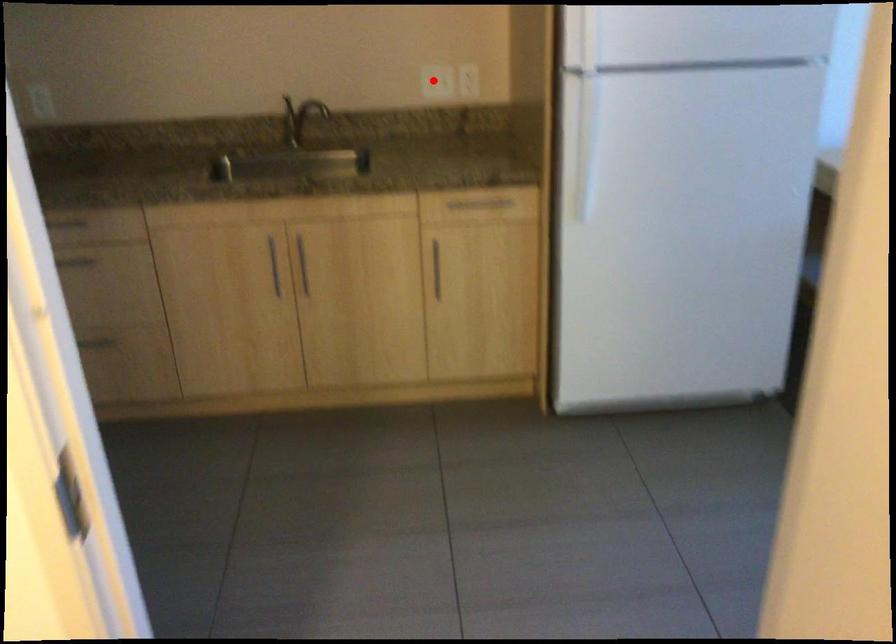
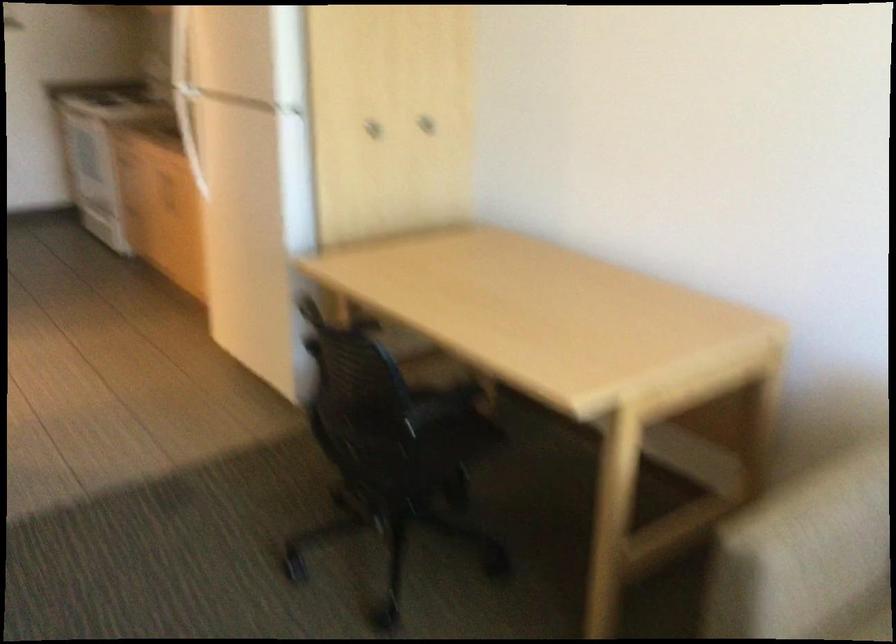
Question: I am providing you with two images of the same scene from different viewpoints. A red point is marked on the first image. Can you still see the location of the red point in image 2?

Choices:
 (A) Yes
 (B) No

Answer: (B)